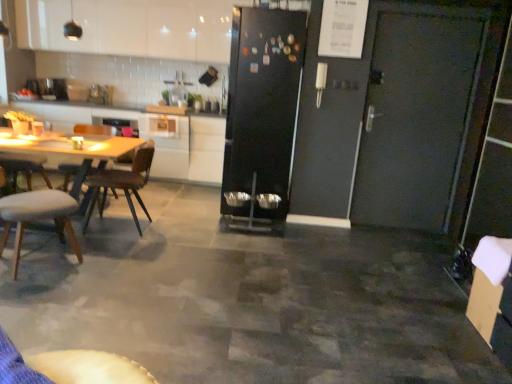
Question: Is white glossy countertop at upper left positioned before white leather chair at left, which ranks as the first chair in front-to-back order?

Choices:
 (A) yes
 (B) no

Answer: (B)

Question: From the image's perspective, is white glossy countertop at upper left beneath white leather chair at left, which ranks as the first chair in front-to-back order?

Choices:
 (A) yes
 (B) no

Answer: (B)

Question: Could you tell me if white glossy countertop at upper left is turned towards white leather chair at left, which ranks as the first chair in front-to-back order?

Choices:
 (A) no
 (B) yes

Answer: (B)

Question: Is white glossy countertop at upper left outside white leather chair at left, which ranks as the first chair in front-to-back order?

Choices:
 (A) no
 (B) yes

Answer: (B)

Question: From a real-world perspective, is white glossy countertop at upper left located higher than white leather chair at left, which ranks as the first chair in front-to-back order?

Choices:
 (A) yes
 (B) no

Answer: (A)

Question: Is white glossy countertop at upper left further to the viewer compared to white leather chair at left, the second chair in the back-to-front sequence?

Choices:
 (A) no
 (B) yes

Answer: (B)

Question: Is white glossy cabinet at center, which is the 1th cabinetry from bottom to top, wider than brown wooden chair at left, arranged as the 1th chair when viewed from the back?

Choices:
 (A) yes
 (B) no

Answer: (A)

Question: Is white glossy cabinet at center, which is the 2th cabinetry in top-to-bottom order, aimed at brown wooden chair at left, the 2th chair when ordered from front to back?

Choices:
 (A) yes
 (B) no

Answer: (A)

Question: Does white glossy cabinet at center, which is the 1th cabinetry from bottom to top, have a greater height compared to brown wooden chair at left, arranged as the 1th chair when viewed from the back?

Choices:
 (A) yes
 (B) no

Answer: (A)

Question: From a real-world perspective, is white glossy cabinet at center, which is the 2th cabinetry in top-to-bottom order, physically above brown wooden chair at left, arranged as the 1th chair when viewed from the back?

Choices:
 (A) no
 (B) yes

Answer: (B)

Question: Does white glossy cabinet at center, which is the 2th cabinetry in top-to-bottom order, have a larger size compared to brown wooden chair at left, arranged as the 1th chair when viewed from the back?

Choices:
 (A) no
 (B) yes

Answer: (B)

Question: Is white glossy cabinet at upper left, which appears as the 1th cabinetry when viewed from the top, smaller than white leather chair at left, which ranks as the first chair in front-to-back order?

Choices:
 (A) no
 (B) yes

Answer: (A)